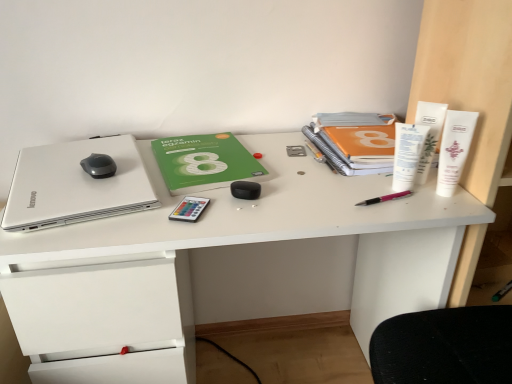
Identify the location of spots to the right of green matte paperback book at center, which is the second paperback book in right-to-left order. (289, 165).